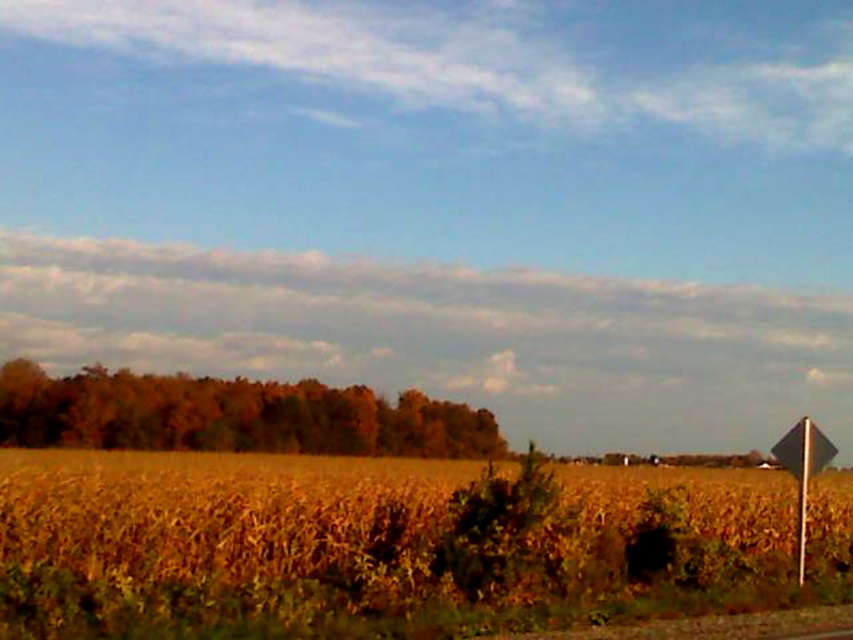
Does golden wheat field at center appear on the left side of metallic diamond-shaped sign at right?

Correct, you'll find golden wheat field at center to the left of metallic diamond-shaped sign at right.

You are a GUI agent. You are given a task and a screenshot of the screen. Output one action in this format:
    pyautogui.click(x=<x>, y=<y>)
    Task: Click on the golden wheat field at center
    The image size is (853, 640).
    Given the screenshot: What is the action you would take?
    pyautogui.click(x=392, y=545)

Describe the element at coordinates (392, 545) in the screenshot. I see `golden wheat field at center` at that location.

Locate an element on the screen. This screenshot has height=640, width=853. golden wheat field at center is located at coordinates (392, 545).

Is point (799, 468) positioned in front of point (799, 524)?

That is True.

Is metallic diamond-shaped sign at right to the left of metallic pole at right from the viewer's perspective?

In fact, metallic diamond-shaped sign at right is to the right of metallic pole at right.

You are a GUI agent. You are given a task and a screenshot of the screen. Output one action in this format:
    pyautogui.click(x=<x>, y=<y>)
    Task: Click on the metallic diamond-shaped sign at right
    The width and height of the screenshot is (853, 640).
    Given the screenshot: What is the action you would take?
    pyautogui.click(x=802, y=470)

Can you confirm if golden wheat field at center is smaller than metallic pole at right?

Actually, golden wheat field at center might be larger than metallic pole at right.

Between golden wheat field at center and metallic pole at right, which one appears on the left side from the viewer's perspective?

Positioned to the left is golden wheat field at center.

Does point (312, 528) lie in front of point (808, 448)?

That is True.

This screenshot has width=853, height=640. In order to click on golden wheat field at center in this screenshot , I will do coord(392,545).